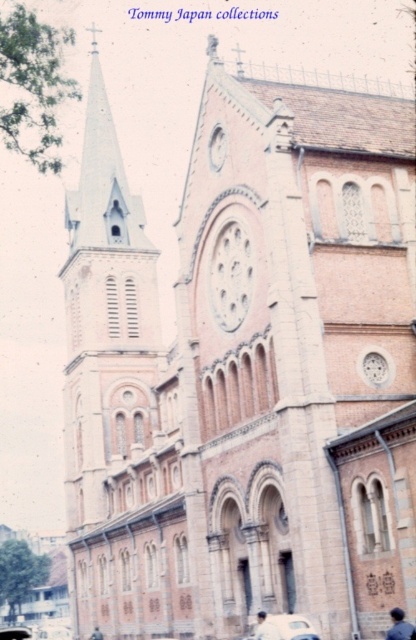
You are standing in front of the historic church and notice two items on the ground near the entrance. You see the dark blue fabric at lower right and the dark brown leather jacket at lower center. Which item is located to the right of the other?

The dark blue fabric at lower right is positioned on the right side of dark brown leather jacket at lower center.

You are a delivery person standing at the entrance of the church and need to place a package on the white matte shirt at center. The white matte car at lower center is in your way. Can you walk around the car to reach the shirt?

The distance between the white matte car at lower center and the white matte shirt at center is 17.31 inches. Since this distance is too narrow to walk around, you cannot go past the car to reach the shirt.